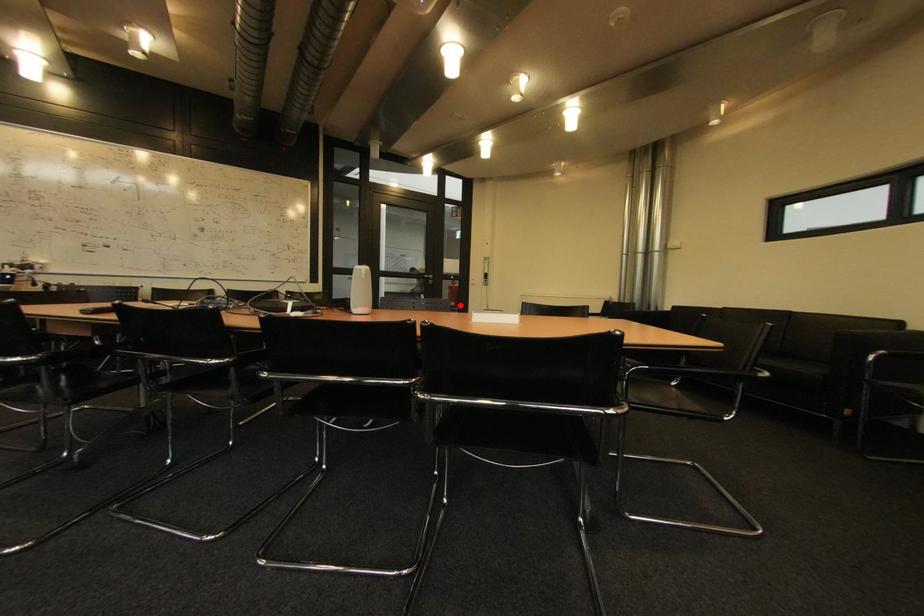
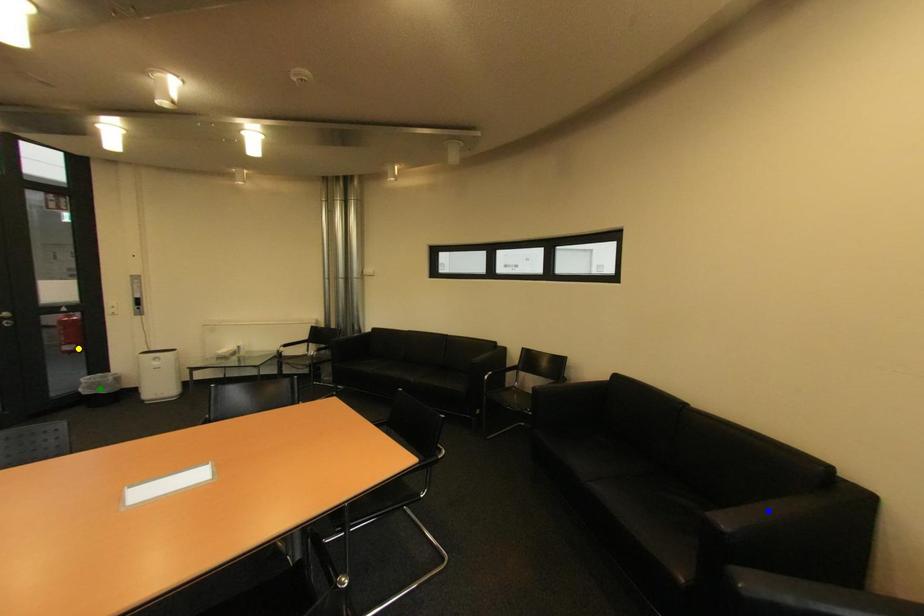
Question: I am providing you with two images of the same scene from different viewpoints. A red point is marked on the first image. You are given multiple points on the second image. Can you choose the point in image 2 that corresponds to the point in image 1?

Choices:
 (A) green point
 (B) blue point
 (C) yellow point

Answer: (C)